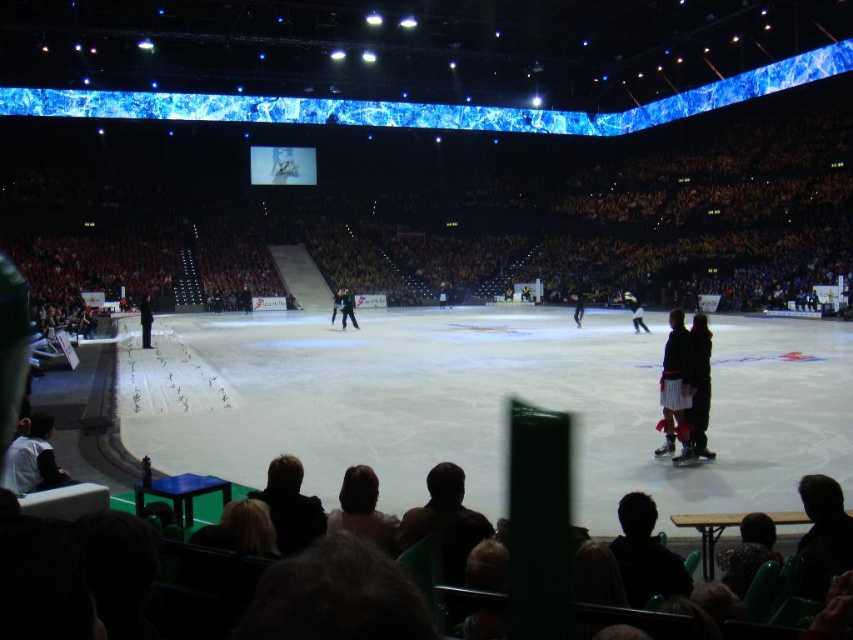
What do you see at coordinates (432, 202) in the screenshot?
I see `dark brown leather seats at lower center` at bounding box center [432, 202].

Is point (534, 218) positioned behind point (341, 298)?

That is True.

You are a GUI agent. You are given a task and a screenshot of the screen. Output one action in this format:
    pyautogui.click(x=<x>, y=<y>)
    Task: Click on the dark brown leather seats at lower center
    The image size is (853, 640).
    Given the screenshot: What is the action you would take?
    pyautogui.click(x=432, y=202)

From the picture: Who is positioned more to the left, dark brown leather seats at lower center or dark hair at lower center?

dark brown leather seats at lower center

Is point (242, 188) farther from camera compared to point (311, 512)?

That is True.

This screenshot has width=853, height=640. I want to click on dark brown leather seats at lower center, so click(432, 202).

Can you confirm if white textured pants at right is bigger than dark brown fur coat at center?

Correct, white textured pants at right is larger in size than dark brown fur coat at center.

Which of these two, white textured pants at right or dark brown fur coat at center, stands shorter?

With less height is dark brown fur coat at center.

Locate an element on the screen. The width and height of the screenshot is (853, 640). white textured pants at right is located at coordinates (676, 388).